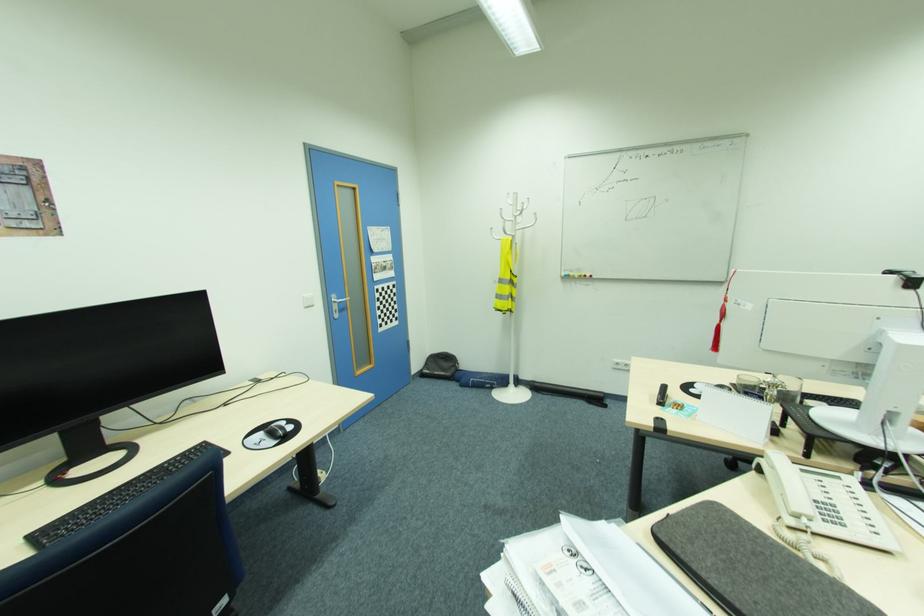
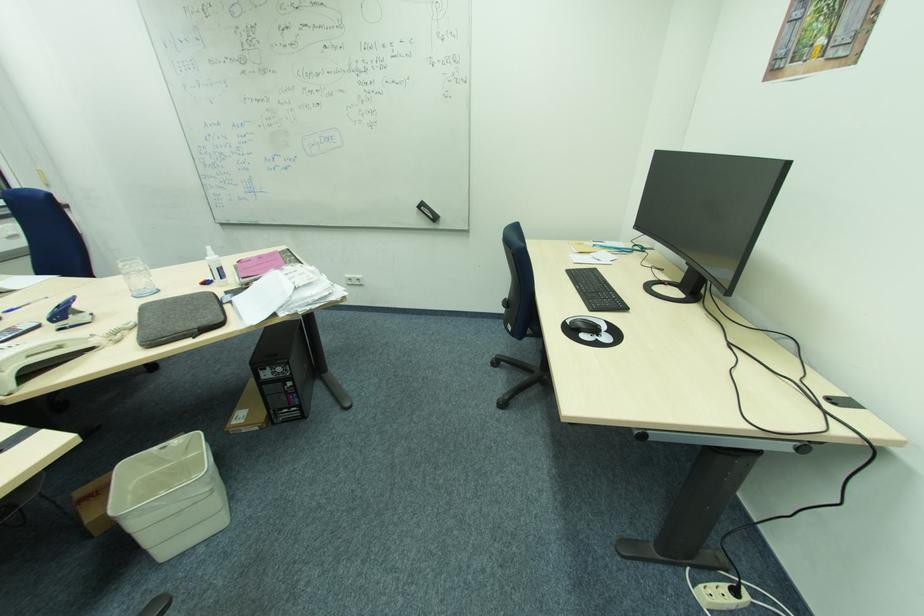
Find the pixel in the second image that matches (713,582) in the first image.

(222, 306)